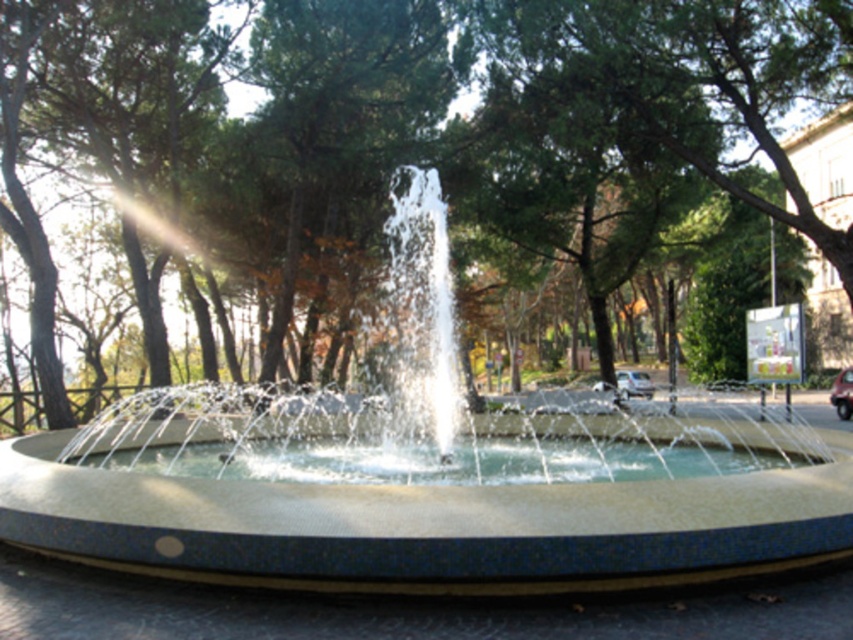
Is white glossy fountain at center to the right of green leafy tree at center from the viewer's perspective?

In fact, white glossy fountain at center is to the left of green leafy tree at center.

Does point (334, 420) come farther from viewer compared to point (444, 19)?

No, (334, 420) is closer to viewer.

Which is behind, point (848, 445) or point (830, 36)?

Point (830, 36)

Where is `white glossy fountain at center`? white glossy fountain at center is located at coordinates (426, 476).